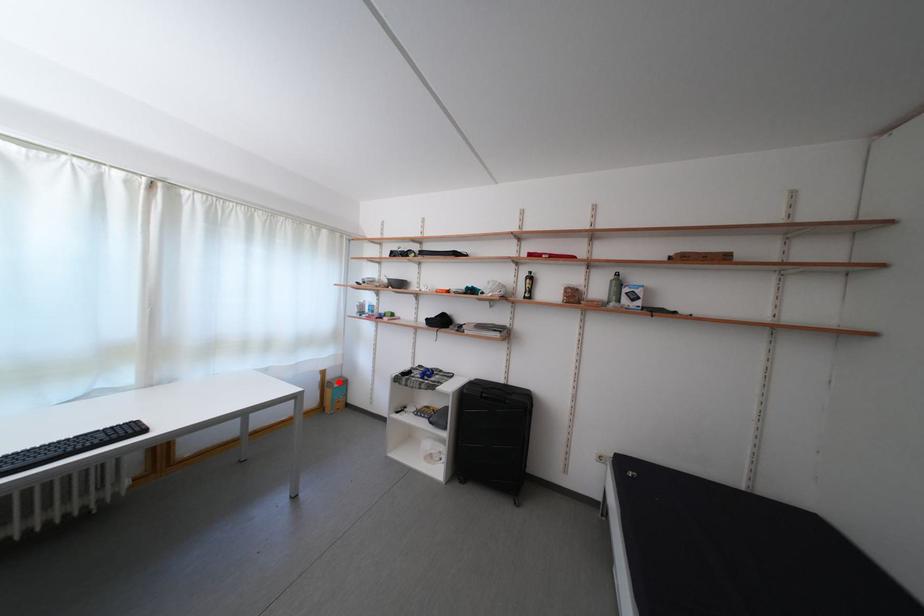
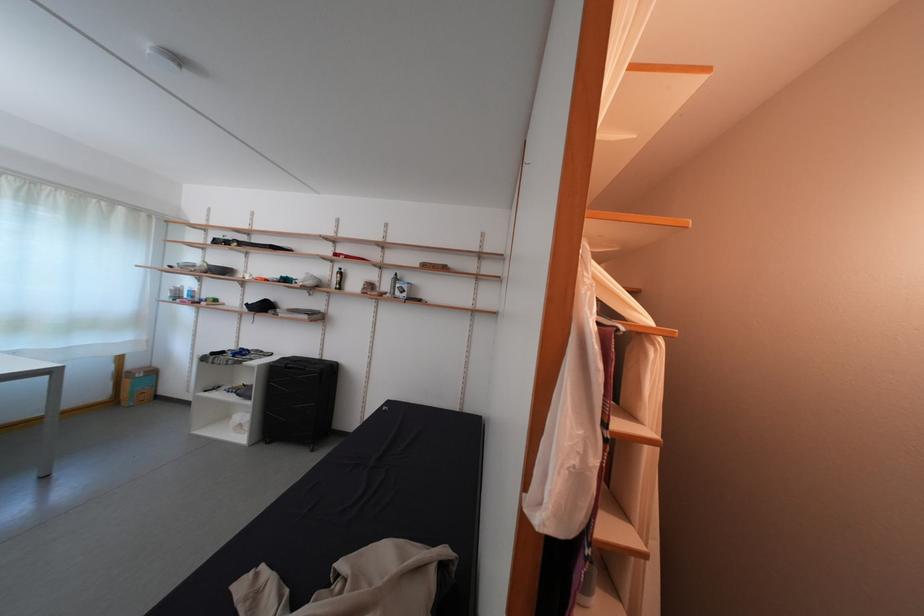
Locate, in the second image, the point that corresponds to the highlighted location in the first image.

(140, 371)